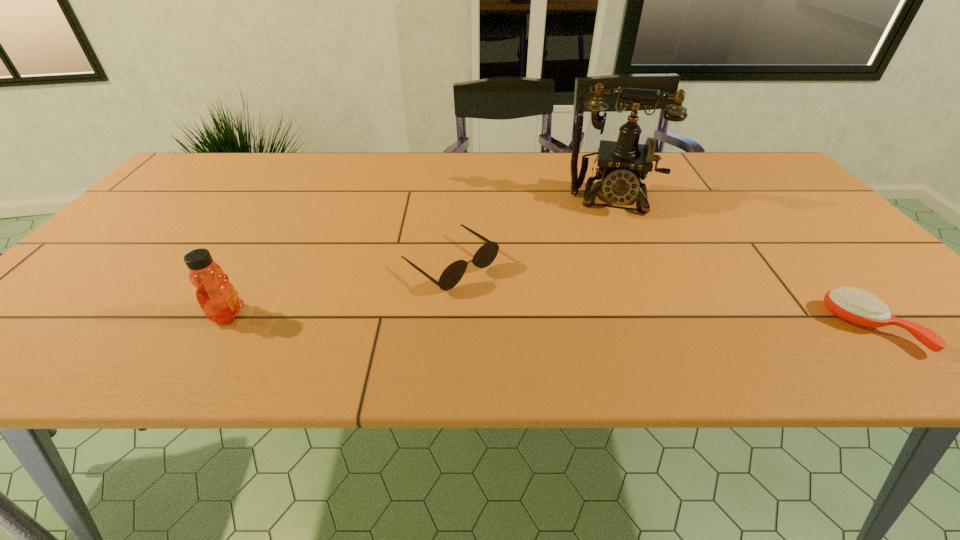
Find the location of `vacant space located on the rotary dial of the farthest object`. vacant space located on the rotary dial of the farthest object is located at coordinates (603, 321).

What are the coordinates of `free space located 0.340m on the rotary dial of the farthest object` in the screenshot? It's located at (604, 307).

This screenshot has width=960, height=540. What are the coordinates of `vacant space located on the rotary dial of the farthest object` in the screenshot? It's located at (605, 285).

The image size is (960, 540). I want to click on vacant position located on the front-facing side of the second object from left to right, so click(x=503, y=302).

The image size is (960, 540). In order to click on object that is at the far edge in this screenshot , I will do `click(623, 164)`.

You are a GUI agent. You are given a task and a screenshot of the screen. Output one action in this format:
    pyautogui.click(x=<x>, y=<y>)
    Task: Click on the honey present at the near edge
    The image size is (960, 540).
    Given the screenshot: What is the action you would take?
    pyautogui.click(x=219, y=300)

This screenshot has height=540, width=960. In order to click on hairbrush positioned at the near edge in this screenshot , I will do `click(858, 307)`.

Image resolution: width=960 pixels, height=540 pixels. What are the coordinates of `object present at the right edge` in the screenshot? It's located at (858, 307).

In order to click on object present at the near right corner in this screenshot , I will do `click(858, 307)`.

Locate an element on the screen. The width and height of the screenshot is (960, 540). blank space at the far edge of the desktop is located at coordinates (337, 157).